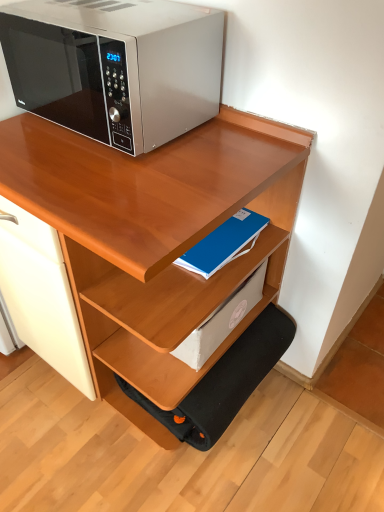
Question: Is blue matte paper at center, the second paperback book when ordered from top to bottom, at the left side of satin silver microwave at upper left?

Choices:
 (A) yes
 (B) no

Answer: (B)

Question: Does blue matte paper at center, acting as the 1th paperback book starting from the bottom, have a greater height compared to satin silver microwave at upper left?

Choices:
 (A) yes
 (B) no

Answer: (B)

Question: Is blue matte paper at center, the second paperback book when ordered from top to bottom, positioned in front of satin silver microwave at upper left?

Choices:
 (A) no
 (B) yes

Answer: (A)

Question: From the image's perspective, is blue matte paper at center, the second paperback book when ordered from top to bottom, located beneath satin silver microwave at upper left?

Choices:
 (A) no
 (B) yes

Answer: (B)

Question: Is blue matte paper at center, acting as the 1th paperback book starting from the bottom, outside satin silver microwave at upper left?

Choices:
 (A) no
 (B) yes

Answer: (B)

Question: Is satin silver microwave at upper left at the back of blue matte paper at center, the second paperback book when ordered from top to bottom?

Choices:
 (A) yes
 (B) no

Answer: (B)

Question: Is the position of wooden desk at upper center more distant than that of blue matte notebook at center, positioned as the second paperback book in bottom-to-top order?

Choices:
 (A) yes
 (B) no

Answer: (B)

Question: Is wooden desk at upper center not within blue matte notebook at center, the 1th paperback book viewed from the top?

Choices:
 (A) no
 (B) yes

Answer: (B)

Question: Is wooden desk at upper center next to blue matte notebook at center, the 1th paperback book viewed from the top, and touching it?

Choices:
 (A) yes
 (B) no

Answer: (B)

Question: From a real-world perspective, is wooden desk at upper center physically below blue matte notebook at center, the 1th paperback book viewed from the top?

Choices:
 (A) no
 (B) yes

Answer: (B)

Question: Is wooden desk at upper center thinner than blue matte notebook at center, the 1th paperback book viewed from the top?

Choices:
 (A) no
 (B) yes

Answer: (A)

Question: From the image's perspective, is wooden desk at upper center under blue matte notebook at center, the 1th paperback book viewed from the top?

Choices:
 (A) no
 (B) yes

Answer: (B)

Question: Is blue matte notebook at center, the 1th paperback book viewed from the top, thinner than blue matte paper at center, the second paperback book when ordered from top to bottom?

Choices:
 (A) yes
 (B) no

Answer: (B)